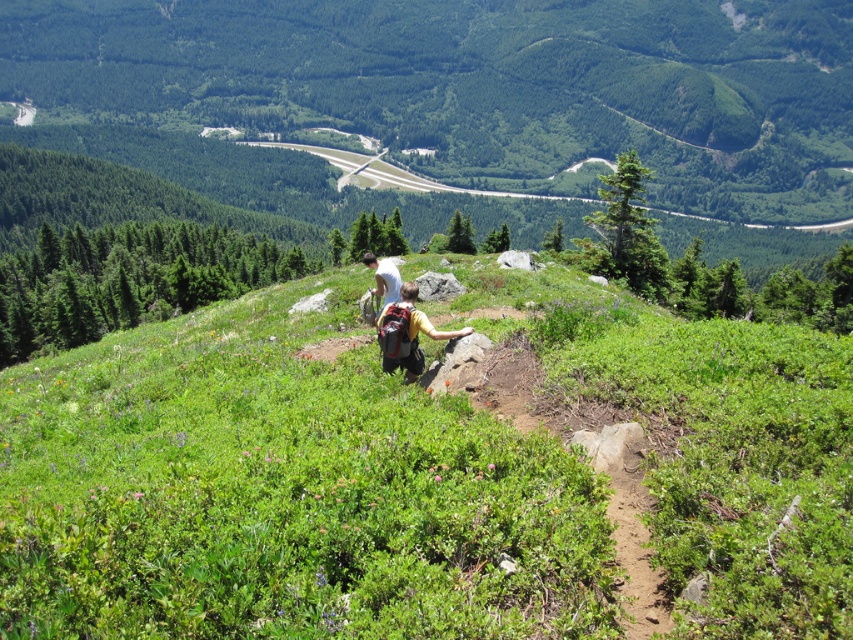
You are a hiker who wants to check the contents of both the matte yellow backpack at center and the yellow fabric backpack at center. Which backpack is located to the right when viewed from the front?

The matte yellow backpack at center is positioned on the right side of the yellow fabric backpack at center, so when viewed from the front, the matte yellow backpack at center is to the right of the yellow fabric backpack at center.

Based on the photo, you are standing at the point marked as point (279, 497) in the image. What do you see directly in front of you?

You see green leafy grass at center directly in front of you.